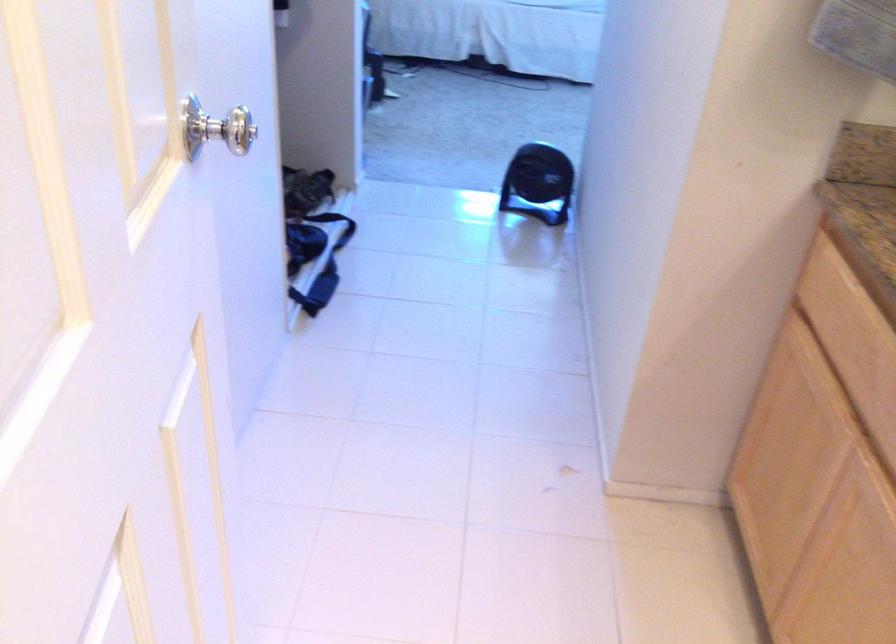
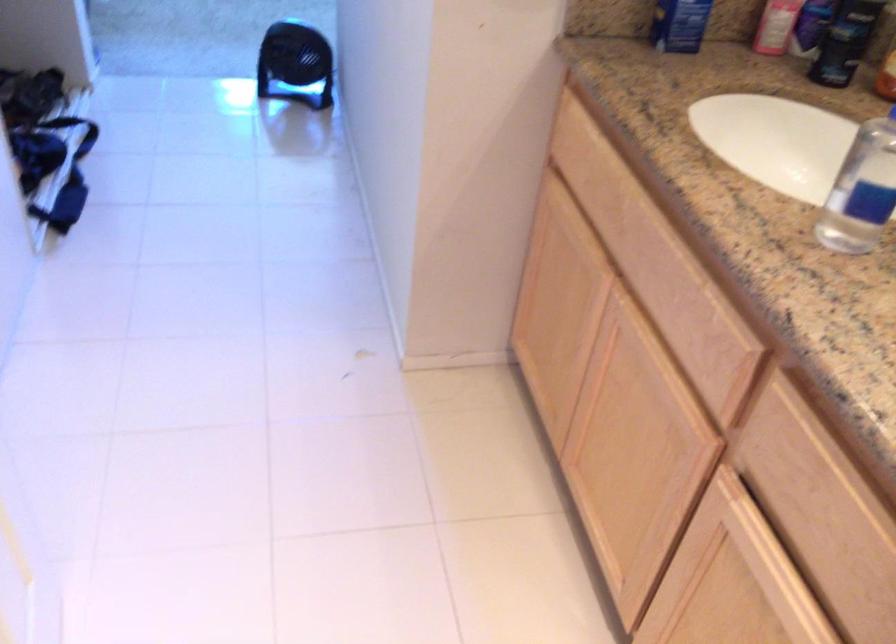
The point at [533,181] is marked in the first image. Where is the corresponding point in the second image?

(295, 64)